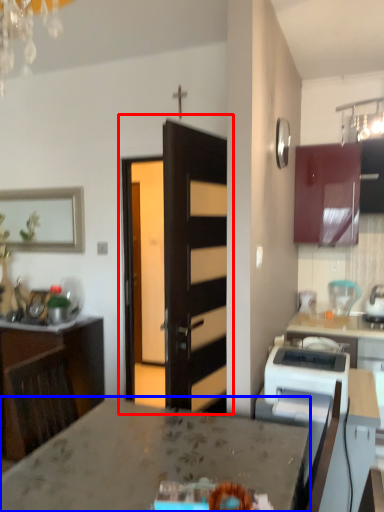
Question: Which of the following is the closest to the observer, door (highlighted by a red box) or countertop (highlighted by a blue box)?

Choices:
 (A) door
 (B) countertop

Answer: (B)